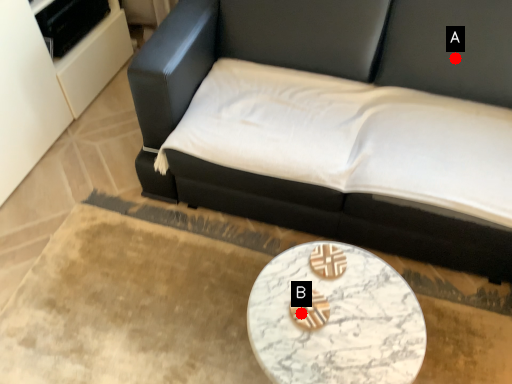
Question: Two points are circled on the image, labeled by A and B beside each circle. Which point appears farthest from the camera in this image?

Choices:
 (A) A is further
 (B) B is further

Answer: (A)